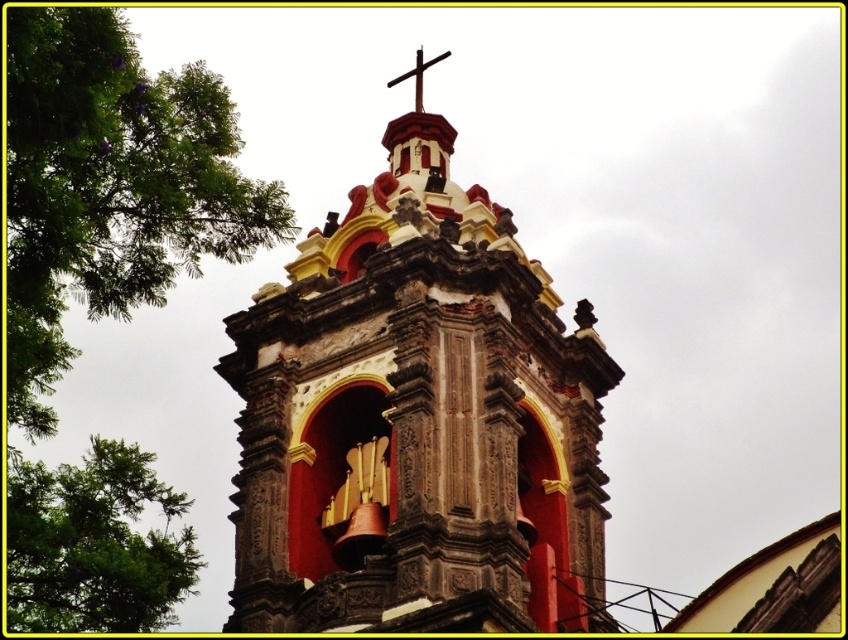
You are standing in front of the bell tower and want to take a photo that includes both the red stone bell tower at center and the green leafy tree at lower left. Which object should you frame first in your camera to ensure both fit in the shot?

The red stone bell tower at center is thinner than the green leafy tree at lower left, so you should frame the wider green leafy tree at lower left first to ensure both fit in the shot.

You are standing in front of the bell tower and want to place a new decorative flagpole. The flagpole needs to be placed between the red stone bell tower at center and the smooth wooden cross at upper center. Is there enough space for the flagpole to be placed vertically between them?

The red stone bell tower at center is positioned under the smooth wooden cross at upper center, so there is vertical space between them. The flagpole can be placed vertically between the red stone bell tower at center and the smooth wooden cross at upper center.